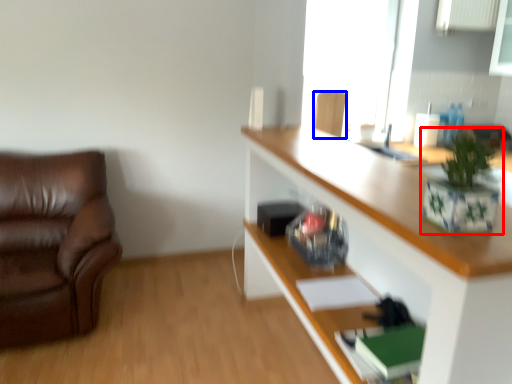
Question: Which point is further to the camera, houseplant (highlighted by a red box) or chair (highlighted by a blue box)?

Choices:
 (A) houseplant
 (B) chair

Answer: (B)